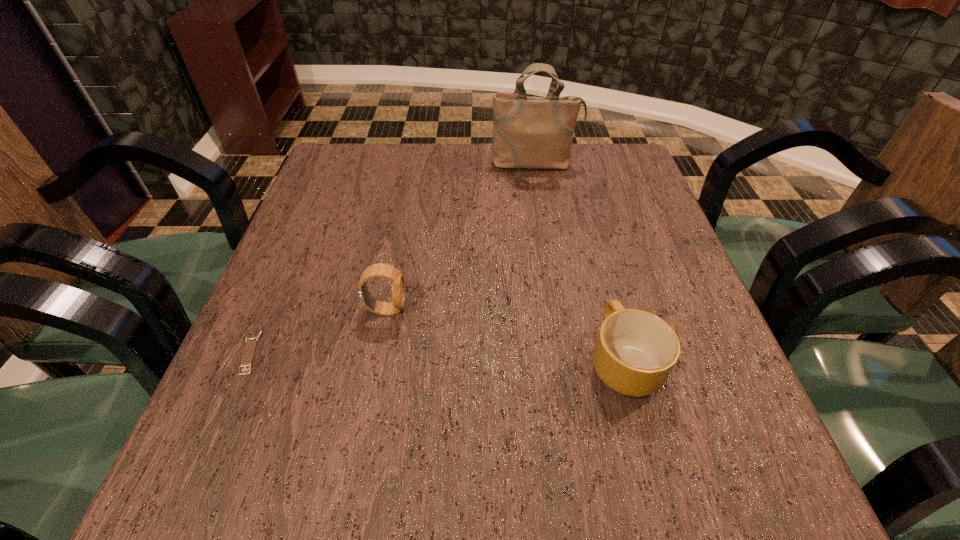
This screenshot has width=960, height=540. In the image, there is a desktop. What are the coordinates of `vacant space at the left edge` in the screenshot? It's located at (260, 367).

In the image, there is a desktop. Where is `vacant space at the right edge`? vacant space at the right edge is located at coordinates (675, 366).

This screenshot has width=960, height=540. I want to click on free space at the far left corner of the desktop, so click(366, 170).

Locate an element on the screen. The height and width of the screenshot is (540, 960). vacant space at the near left corner of the desktop is located at coordinates (257, 496).

Find the location of `vacant space in between the shorter watch and the third tallest object`. vacant space in between the shorter watch and the third tallest object is located at coordinates (436, 355).

Image resolution: width=960 pixels, height=540 pixels. I want to click on free space that is in between the right watch and the shoulder bag, so click(x=461, y=237).

Identify the location of vacant space that is in between the right watch and the shortest object. This screenshot has height=540, width=960. (318, 330).

Find the location of a particular element. The width and height of the screenshot is (960, 540). blank region between the leftmost object and the farthest object is located at coordinates (392, 256).

Find the location of a particular element. vacant space that's between the taller watch and the shortest object is located at coordinates (318, 330).

In order to click on free space between the shorter watch and the mug in this screenshot , I will do `click(436, 355)`.